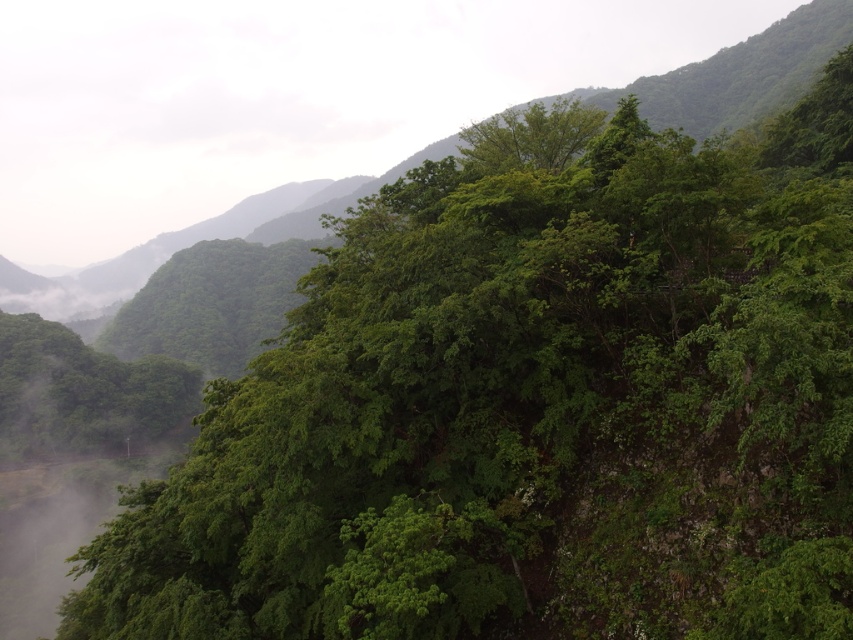
Who is lower down, green leafy mountain at center or green leafy tree at upper center?

green leafy tree at upper center

Which is behind, point (718, 60) or point (511, 129)?

The point (718, 60) is more distant.

This screenshot has width=853, height=640. Describe the element at coordinates (193, 243) in the screenshot. I see `green leafy mountain at center` at that location.

This screenshot has width=853, height=640. I want to click on green leafy mountain at center, so [x=193, y=243].